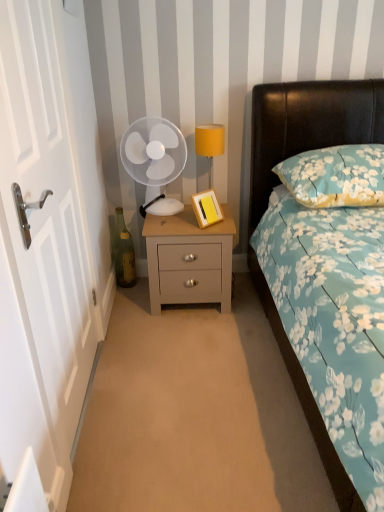
Question: Should I look upward or downward to see white wooden door at left?

Choices:
 (A) up
 (B) down

Answer: (A)

Question: Is white wooden door at left to the right of yellow fabric lampshade at upper right from the viewer's perspective?

Choices:
 (A) yes
 (B) no

Answer: (B)

Question: Is white wooden door at left to the left of yellow fabric lampshade at upper right from the viewer's perspective?

Choices:
 (A) no
 (B) yes

Answer: (B)

Question: Does white wooden door at left have a lesser width compared to yellow fabric lampshade at upper right?

Choices:
 (A) no
 (B) yes

Answer: (B)

Question: From a real-world perspective, is white wooden door at left below yellow fabric lampshade at upper right?

Choices:
 (A) no
 (B) yes

Answer: (A)

Question: Can we say white wooden door at left lies outside yellow fabric lampshade at upper right?

Choices:
 (A) no
 (B) yes

Answer: (B)

Question: From a real-world perspective, is white wooden door at left located higher than yellow fabric lampshade at upper right?

Choices:
 (A) yes
 (B) no

Answer: (A)

Question: From a real-world perspective, is floral fabric pillow at upper right located higher than yellow fabric lampshade at upper right?

Choices:
 (A) yes
 (B) no

Answer: (A)

Question: Does floral fabric pillow at upper right have a lesser width compared to yellow fabric lampshade at upper right?

Choices:
 (A) no
 (B) yes

Answer: (A)

Question: Can you confirm if floral fabric pillow at upper right is positioned to the right of yellow fabric lampshade at upper right?

Choices:
 (A) no
 (B) yes

Answer: (B)

Question: Does floral fabric pillow at upper right appear on the left side of yellow fabric lampshade at upper right?

Choices:
 (A) no
 (B) yes

Answer: (A)

Question: From the image's perspective, is floral fabric pillow at upper right above yellow fabric lampshade at upper right?

Choices:
 (A) no
 (B) yes

Answer: (A)

Question: Is floral fabric pillow at upper right shorter than yellow fabric lampshade at upper right?

Choices:
 (A) yes
 (B) no

Answer: (A)

Question: Is white wooden door at left taller than matte gray nightstand at center?

Choices:
 (A) yes
 (B) no

Answer: (A)